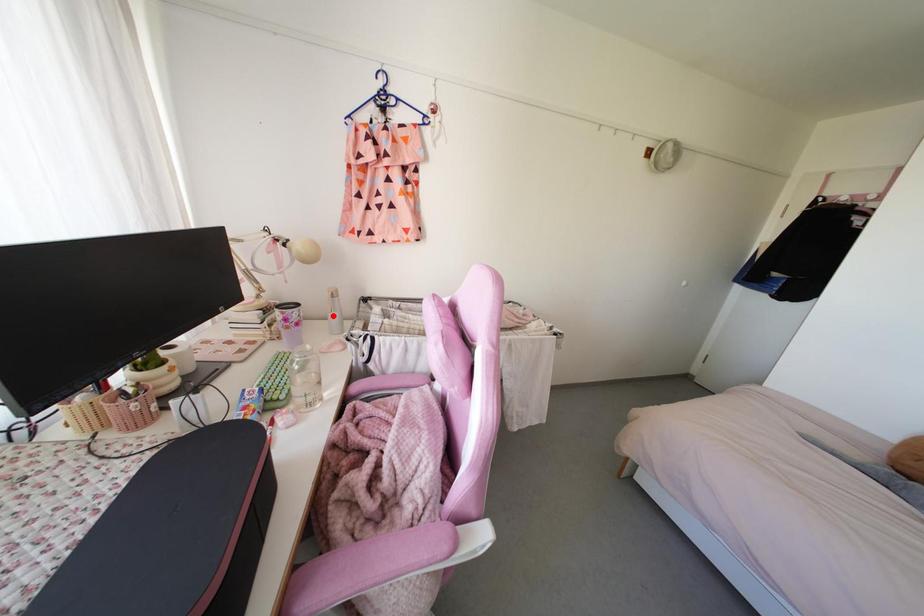
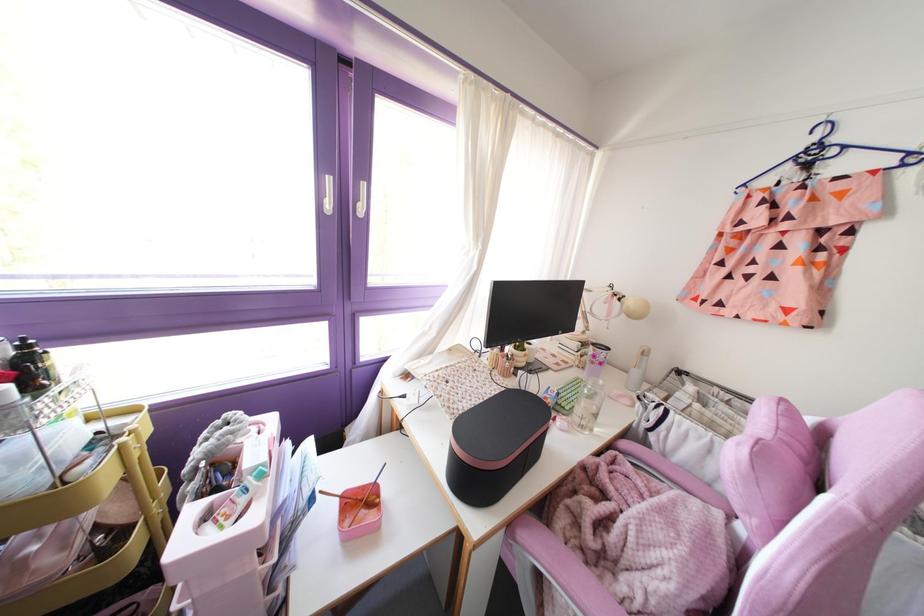
Question: I am providing you with two images of the same scene from different viewpoints. A red point is marked on the first image. At the location where the point appears in image 1, is it still visible in image 2?

Choices:
 (A) Yes
 (B) No

Answer: (A)